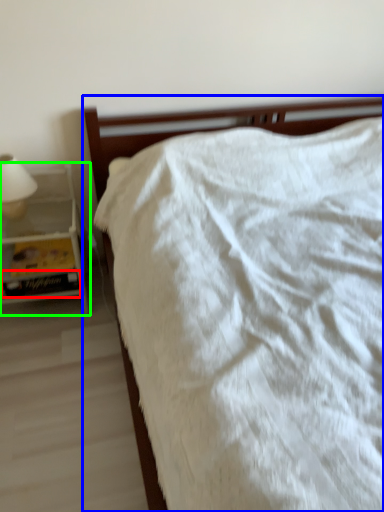
Question: Estimate the real-world distances between objects in this image. Which object is closer to paperback book (highlighted by a red box), bed (highlighted by a blue box) or nightstand (highlighted by a green box)?

Choices:
 (A) bed
 (B) nightstand

Answer: (B)